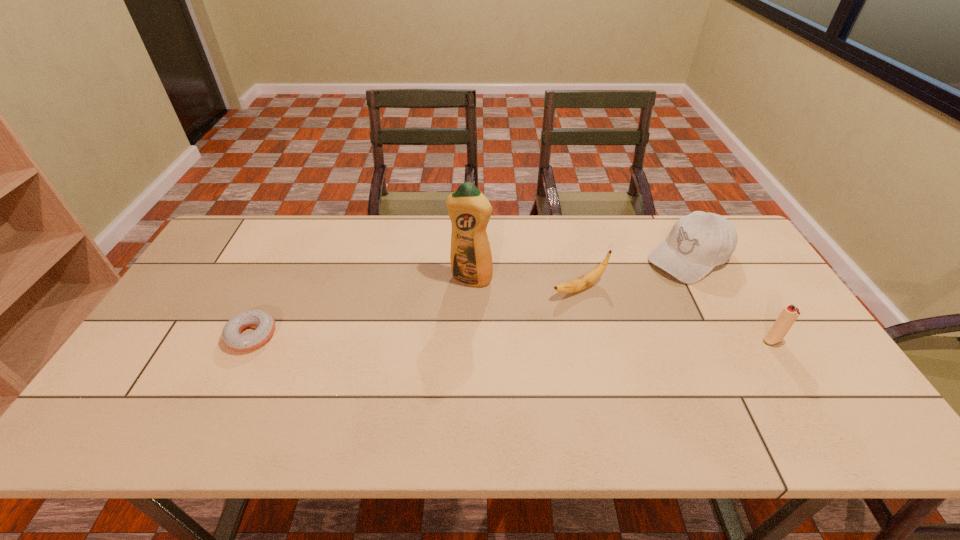
Find the location of a particular element. The image size is (960, 540). vacant space on the desktop that is between the shortest object and the igniter and is positioned on the label of the tallest object is located at coordinates (443, 338).

Where is `vacant space on the desktop that is between the leftmost object and the igniter and is positioned on the peel of the third object from right to left from the top`? The height and width of the screenshot is (540, 960). vacant space on the desktop that is between the leftmost object and the igniter and is positioned on the peel of the third object from right to left from the top is located at coordinates (471, 338).

Where is `vacant space on the desktop that is between the shortest object and the igniter and is positioned on the front-facing side of the baseball cap`? vacant space on the desktop that is between the shortest object and the igniter and is positioned on the front-facing side of the baseball cap is located at coordinates (564, 339).